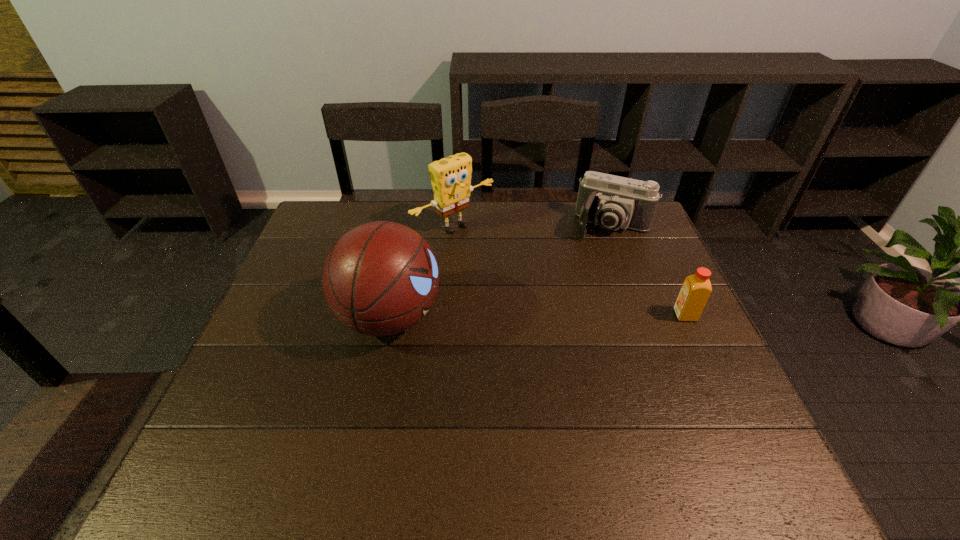
This screenshot has height=540, width=960. I want to click on vacant space at the near edge, so click(463, 406).

Image resolution: width=960 pixels, height=540 pixels. In the image, there is a desktop. What are the coordinates of `free region at the left edge` in the screenshot? It's located at (326, 309).

This screenshot has width=960, height=540. In the image, there is a desktop. What are the coordinates of `vacant space at the right edge` in the screenshot? It's located at (655, 292).

You are a GUI agent. You are given a task and a screenshot of the screen. Output one action in this format:
    pyautogui.click(x=<x>, y=<y>)
    Task: Click on the vacant area at the far left corner
    This screenshot has height=540, width=960.
    Given the screenshot: What is the action you would take?
    pyautogui.click(x=314, y=228)

The image size is (960, 540). In the image, there is a desktop. Identify the location of vacant space at the far right corner. (635, 230).

Find the location of a particular element. This screenshot has width=960, height=540. free point between the sponge and the orange juice is located at coordinates (569, 271).

Find the location of `free spot between the sponge and the orange juice`. free spot between the sponge and the orange juice is located at coordinates (569, 271).

Where is `free spot between the orange juice and the camera`? This screenshot has width=960, height=540. free spot between the orange juice and the camera is located at coordinates (648, 271).

Locate an element on the screen. free space between the orange juice and the sponge is located at coordinates (569, 271).

This screenshot has width=960, height=540. Identify the location of vacant region between the basketball and the camera. (501, 271).